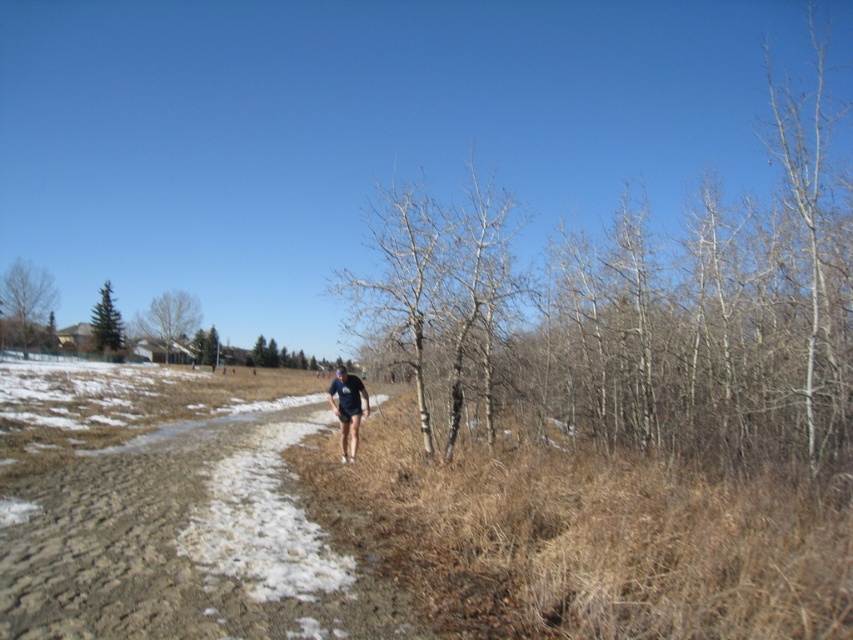
Can you confirm if brown dirt track at center is shorter than brown bark tree at left?

Indeed, brown dirt track at center has a lesser height compared to brown bark tree at left.

Between point (128, 464) and point (48, 298), which one is positioned in front?

Point (128, 464)

Between point (222, 563) and point (22, 298), which one is positioned behind?

The point (22, 298) is behind.

Find the location of a particular element. The image size is (853, 640). brown dirt track at center is located at coordinates (186, 541).

Can you confirm if smooth bark tree at center is positioned above green matte evergreen tree at left?

Correct, smooth bark tree at center is located above green matte evergreen tree at left.

Is point (664, 256) closer to viewer compared to point (106, 285)?

Yes, it is.

Which is behind, point (563, 324) or point (115, 310)?

Point (115, 310)

Find the location of a particular element. smooth bark tree at center is located at coordinates (666, 321).

Does brown dirt track at center appear over dark blue fabric at center?

No, brown dirt track at center is not above dark blue fabric at center.

Which is below, brown dirt track at center or dark blue fabric at center?

brown dirt track at center

Measure the distance between point (271, 548) and camera.

Point (271, 548) and camera are 6.74 meters apart.

I want to click on brown dirt track at center, so click(186, 541).